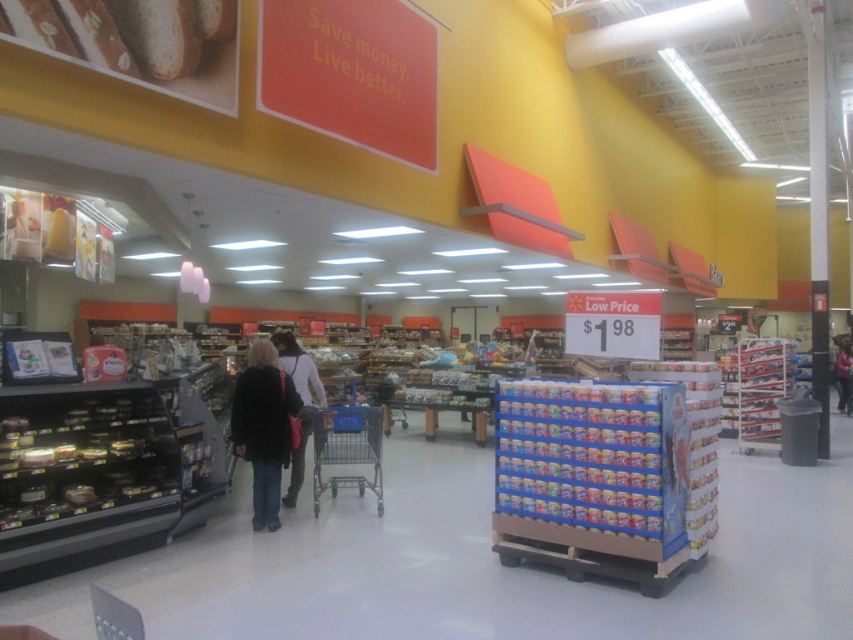
Who is shorter, blue metal shopping cart at center or black fabric purse at center?

black fabric purse at center is shorter.

Does point (358, 452) come behind point (293, 490)?

No, (358, 452) is closer to viewer.

The width and height of the screenshot is (853, 640). I want to click on blue metal shopping cart at center, so click(x=347, y=449).

Which is behind, point (299, 358) or point (839, 387)?

The point (839, 387) is more distant.

Between point (287, 374) and point (848, 353), which one is positioned in front?

Point (287, 374)

The image size is (853, 640). In order to click on black fabric purse at center in this screenshot , I will do (x=299, y=369).

Between black fabric jacket at center and dark brown leather jacket at center, which one is positioned lower?

dark brown leather jacket at center is lower down.

Is point (234, 433) closer to viewer compared to point (850, 412)?

That is True.

The width and height of the screenshot is (853, 640). Identify the location of black fabric jacket at center. (264, 428).